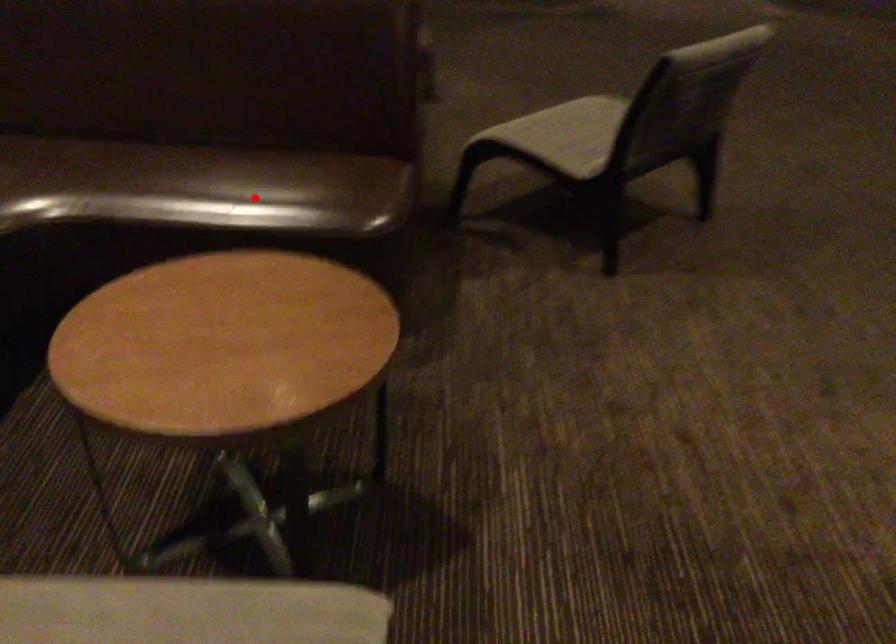
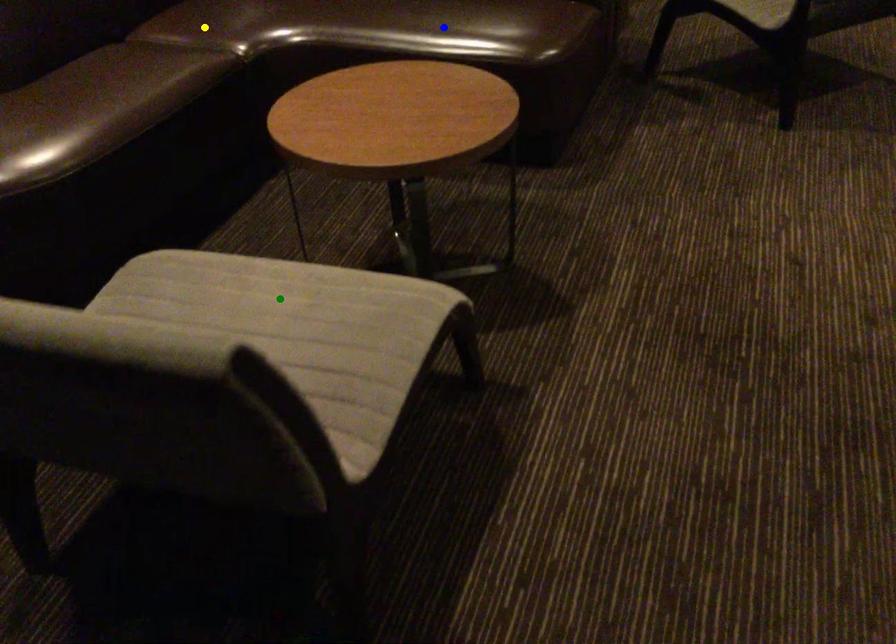
Question: I am providing you with two images of the same scene from different viewpoints. A red point is marked on the first image. You are given multiple points on the second image. Which point in image 2 is actually the same real-world point as the red point in image 1?

Choices:
 (A) blue point
 (B) green point
 (C) yellow point

Answer: (A)